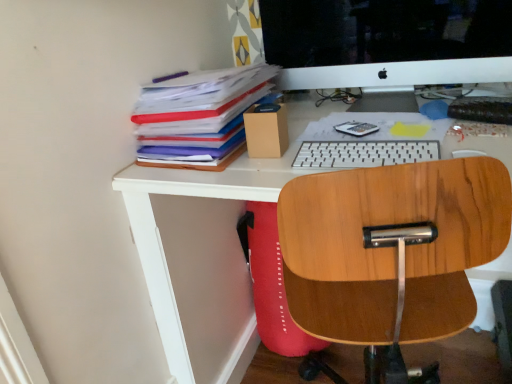
Question: Considering the relative positions of multicolored paper at upper left and white plastic keyboard at center in the image provided, is multicolored paper at upper left in front of white plastic keyboard at center?

Choices:
 (A) yes
 (B) no

Answer: (B)

Question: Does multicolored paper at upper left touch white plastic keyboard at center?

Choices:
 (A) yes
 (B) no

Answer: (B)

Question: From the image's perspective, is multicolored paper at upper left on top of white plastic keyboard at center?

Choices:
 (A) yes
 (B) no

Answer: (A)

Question: Considering the relative sizes of multicolored paper at upper left and white plastic keyboard at center in the image provided, is multicolored paper at upper left wider than white plastic keyboard at center?

Choices:
 (A) no
 (B) yes

Answer: (B)

Question: Can you confirm if multicolored paper at upper left is thinner than white plastic keyboard at center?

Choices:
 (A) no
 (B) yes

Answer: (A)

Question: Considering the positions of white glossy computer monitor at upper center and multicolored paper at upper left in the image, is white glossy computer monitor at upper center taller or shorter than multicolored paper at upper left?

Choices:
 (A) short
 (B) tall

Answer: (B)

Question: In terms of width, does white glossy computer monitor at upper center look wider or thinner when compared to multicolored paper at upper left?

Choices:
 (A) wide
 (B) thin

Answer: (B)

Question: From the image's perspective, is white glossy computer monitor at upper center positioned above or below multicolored paper at upper left?

Choices:
 (A) above
 (B) below

Answer: (A)

Question: Does point (423, 54) appear closer or farther from the camera than point (256, 72)?

Choices:
 (A) closer
 (B) farther

Answer: (B)

Question: Visually, is white glossy computer monitor at upper center positioned to the left or to the right of white plastic keyboard at center?

Choices:
 (A) left
 (B) right

Answer: (B)

Question: Does point (462, 56) appear closer or farther from the camera than point (312, 157)?

Choices:
 (A) farther
 (B) closer

Answer: (A)

Question: Is white glossy computer monitor at upper center in front of or behind white plastic keyboard at center in the image?

Choices:
 (A) front
 (B) behind

Answer: (B)

Question: Considering the positions of white glossy computer monitor at upper center and white plastic keyboard at center in the image, is white glossy computer monitor at upper center bigger or smaller than white plastic keyboard at center?

Choices:
 (A) small
 (B) big

Answer: (B)

Question: Is white plastic keyboard at center taller or shorter than white glossy computer monitor at upper center?

Choices:
 (A) short
 (B) tall

Answer: (A)

Question: Is white plastic keyboard at center in front of or behind white glossy computer monitor at upper center in the image?

Choices:
 (A) behind
 (B) front

Answer: (B)